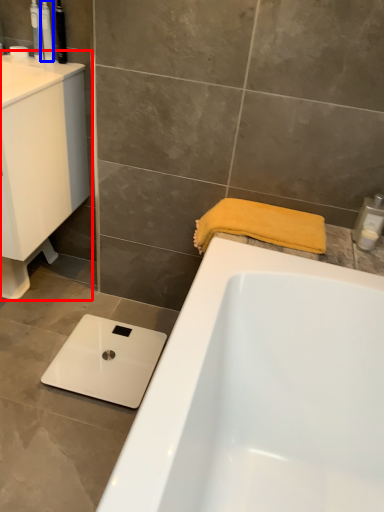
Question: Which of the following is the closest to the observer, sink (highlighted by a red box) or toiletry (highlighted by a blue box)?

Choices:
 (A) sink
 (B) toiletry

Answer: (A)